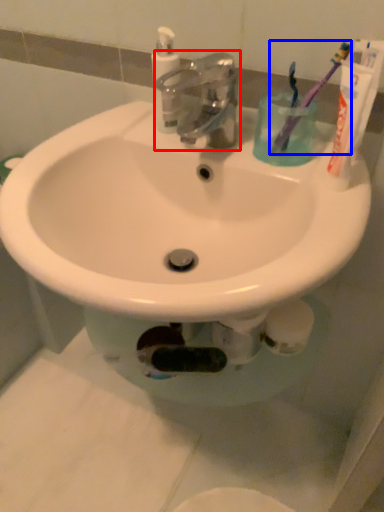
Question: Which object appears closest to the camera in this image, tap (highlighted by a red box) or toothbrush (highlighted by a blue box)?

Choices:
 (A) tap
 (B) toothbrush

Answer: (A)